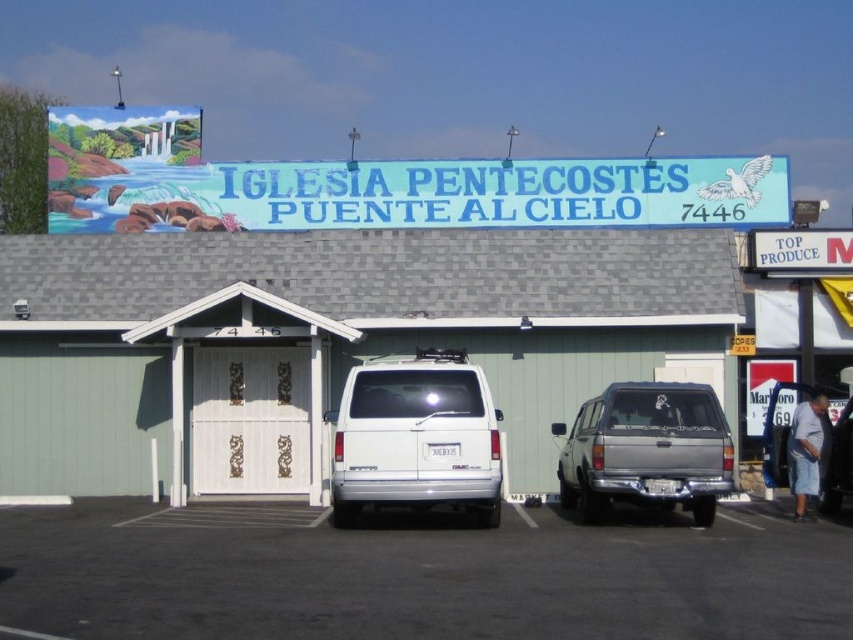
Question: Which object appears farthest from the camera in this image?

Choices:
 (A) silver metallic van at center
 (B) white matte van at center

Answer: (B)

Question: Estimate the real-world distances between objects in this image. Which object is farther from the white matte van at center?

Choices:
 (A) white plastic sign at upper right
 (B) gray cotton shirt at lower right
 (C) black asphalt parking lot at center

Answer: (B)

Question: Is white matte suv at center to the right of silver metallic van at center from the viewer's perspective?

Choices:
 (A) no
 (B) yes

Answer: (A)

Question: Can you confirm if white matte suv at center is thinner than gray cotton shirt at lower right?

Choices:
 (A) no
 (B) yes

Answer: (A)

Question: Among these points, which one is farthest from the camera?

Choices:
 (A) (798, 250)
 (B) (689, 298)
 (C) (817, 486)

Answer: (A)

Question: Considering the relative positions of black asphalt parking lot at center and white matte suv at center in the image provided, where is black asphalt parking lot at center located with respect to white matte suv at center?

Choices:
 (A) left
 (B) right

Answer: (A)